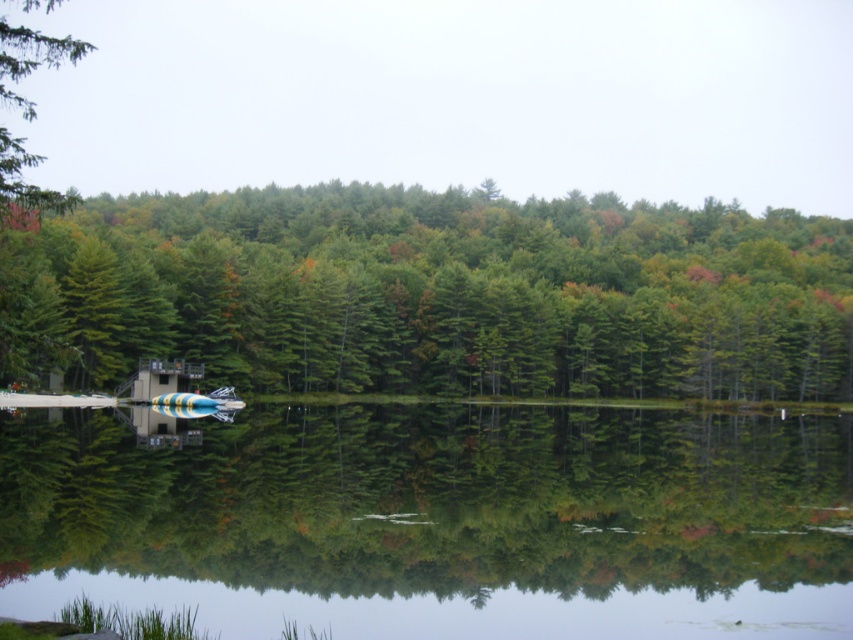
You are standing at the point labeled as point (439, 522) in the image. What do you see directly in front of you?

You see clear water at center directly in front of you at point (439, 522).

You are standing at the lakeside and want to reach a specific point marked at coordinates point (827, 596). If your maximum walking distance is 60 feet, can you comfortably walk to that point without exceeding your limit?

The distance of point (827, 596) from viewer is 65.91 feet, which exceeds your maximum walking distance of 60 feet. Therefore, you cannot comfortably walk to that point without exceeding your limit.